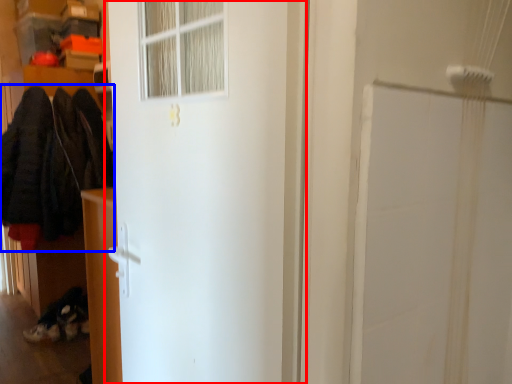
Question: Which point is closer to the camera, door (highlighted by a red box) or clothing (highlighted by a blue box)?

Choices:
 (A) door
 (B) clothing

Answer: (A)